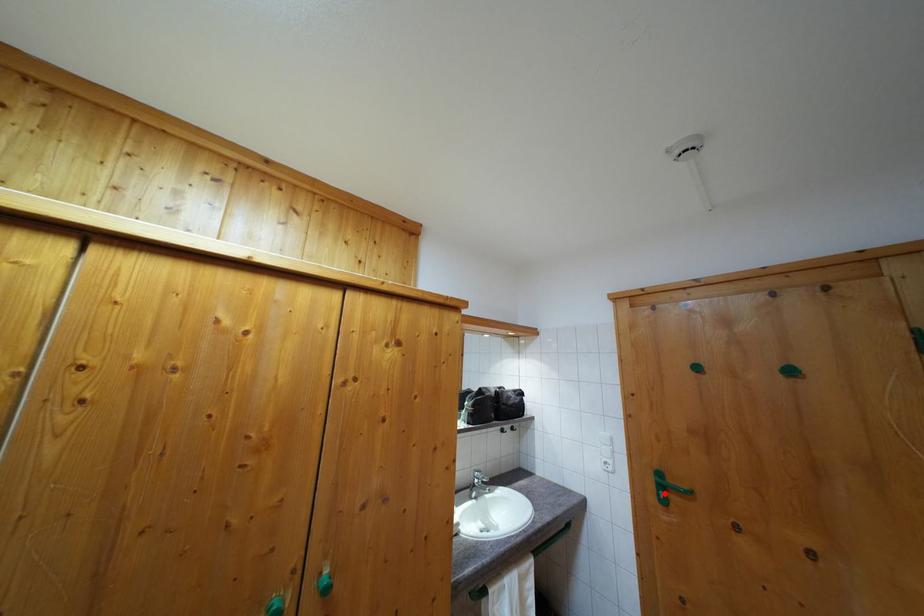
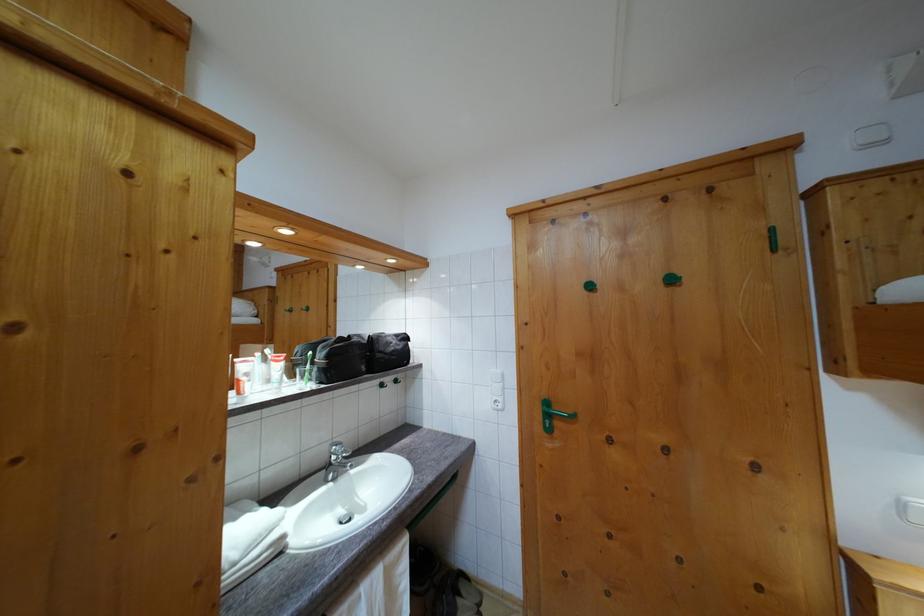
Find the pixel in the second image that matches the highlighted location in the first image.

(552, 422)